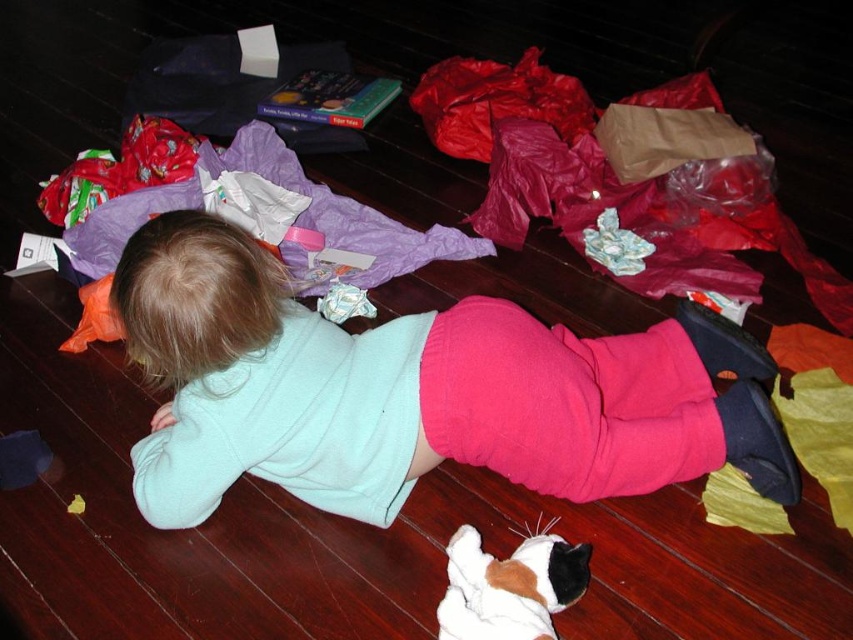
Can you confirm if light blue fleece at center is shorter than white plush cat at lower center?

Incorrect, light blue fleece at center's height does not fall short of white plush cat at lower center's.

Between light blue fleece at center and white plush cat at lower center, which one has more height?

light blue fleece at center is taller.

Between point (711, 378) and point (555, 534), which one is positioned in front?

Point (555, 534)

You are a GUI agent. You are given a task and a screenshot of the screen. Output one action in this format:
    pyautogui.click(x=<x>, y=<y>)
    Task: Click on the light blue fleece at center
    
    Given the screenshot: What is the action you would take?
    pyautogui.click(x=415, y=392)